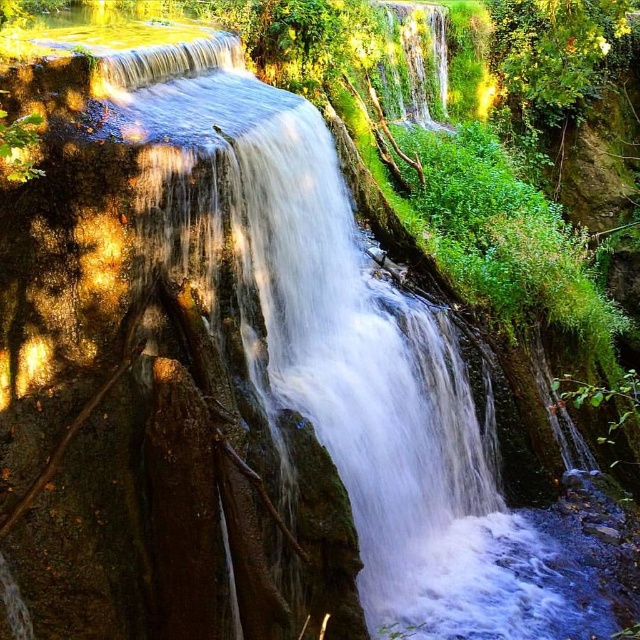
Who is taller, white frothy water at center or green leafy tree at upper right?

white frothy water at center

The width and height of the screenshot is (640, 640). What do you see at coordinates (336, 333) in the screenshot? I see `white frothy water at center` at bounding box center [336, 333].

Does point (404, 392) come closer to viewer compared to point (540, 33)?

Yes, point (404, 392) is in front of point (540, 33).

The height and width of the screenshot is (640, 640). In order to click on white frothy water at center in this screenshot , I will do `click(336, 333)`.